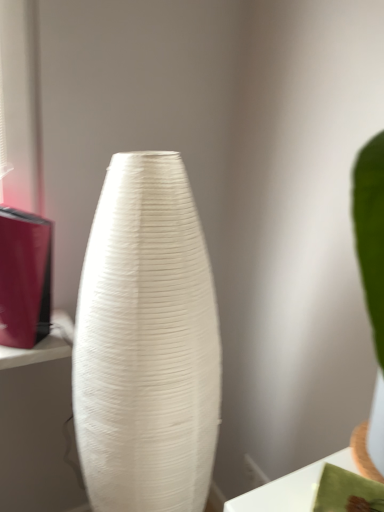
Question: Looking at their shapes, would you say white glossy table at lower right is wider or thinner than white textured vase at center?

Choices:
 (A) wide
 (B) thin

Answer: (B)

Question: Is point (246, 496) closer or farther from the camera than point (76, 377)?

Choices:
 (A) closer
 (B) farther

Answer: (A)

Question: Would you say white glossy table at lower right is to the left or to the right of white textured vase at center in the picture?

Choices:
 (A) left
 (B) right

Answer: (B)

Question: Would you say white textured vase at center is inside or outside white glossy table at lower right?

Choices:
 (A) inside
 (B) outside

Answer: (B)

Question: Considering the relative positions of white textured vase at center and white glossy table at lower right in the image provided, is white textured vase at center to the left or to the right of white glossy table at lower right?

Choices:
 (A) left
 (B) right

Answer: (A)

Question: Relative to white glossy table at lower right, is white textured vase at center in front or behind?

Choices:
 (A) behind
 (B) front

Answer: (A)

Question: From the image's perspective, is white textured vase at center above or below white glossy table at lower right?

Choices:
 (A) above
 (B) below

Answer: (B)